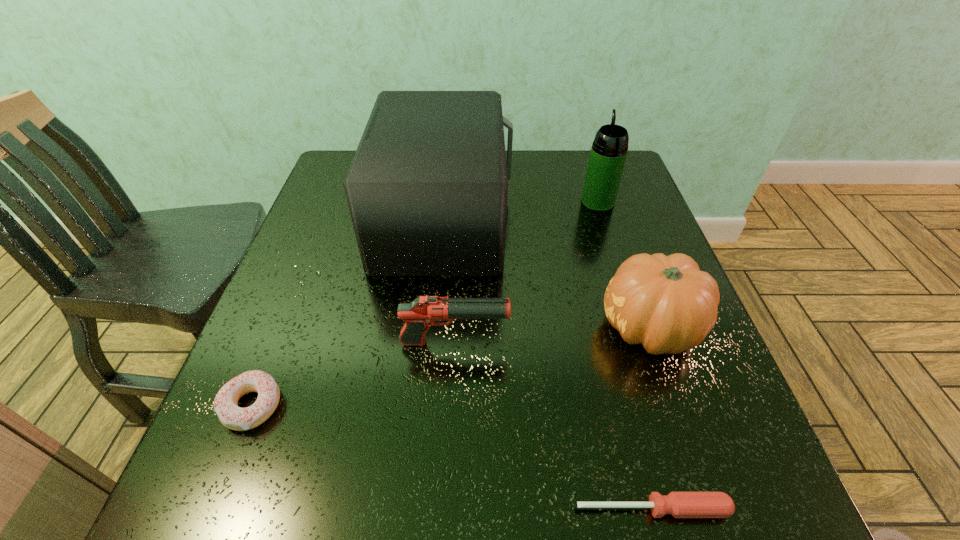
You are a GUI agent. You are given a task and a screenshot of the screen. Output one action in this format:
    pyautogui.click(x=<x>, y=<y>)
    Task: Click on the object that is at the near edge
    Image resolution: width=960 pixels, height=540 pixels.
    Given the screenshot: What is the action you would take?
    pyautogui.click(x=679, y=504)

Locate an element on the screen. The height and width of the screenshot is (540, 960). object located at the left edge is located at coordinates (233, 417).

The width and height of the screenshot is (960, 540). Identify the location of thermos bottle positioned at the right edge. (608, 154).

Where is `pumpkin present at the right edge`? The height and width of the screenshot is (540, 960). pumpkin present at the right edge is located at coordinates (666, 303).

Image resolution: width=960 pixels, height=540 pixels. I want to click on screwdriver present at the right edge, so click(x=679, y=504).

Identify the location of object at the far right corner. The image size is (960, 540). (608, 154).

Identify the location of object that is at the near right corner. This screenshot has width=960, height=540. (679, 504).

Identify the location of blank space at the far edge of the desktop. (552, 150).

In the image, there is a desktop. Where is `blank space at the near edge`? The width and height of the screenshot is (960, 540). blank space at the near edge is located at coordinates (453, 481).

Locate an element on the screen. The height and width of the screenshot is (540, 960). vacant space at the left edge of the desktop is located at coordinates (355, 269).